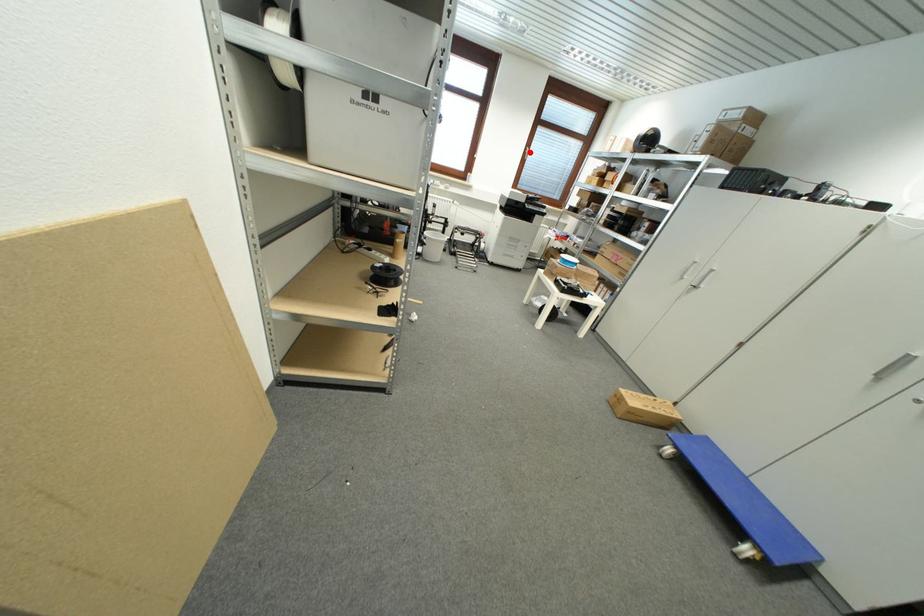
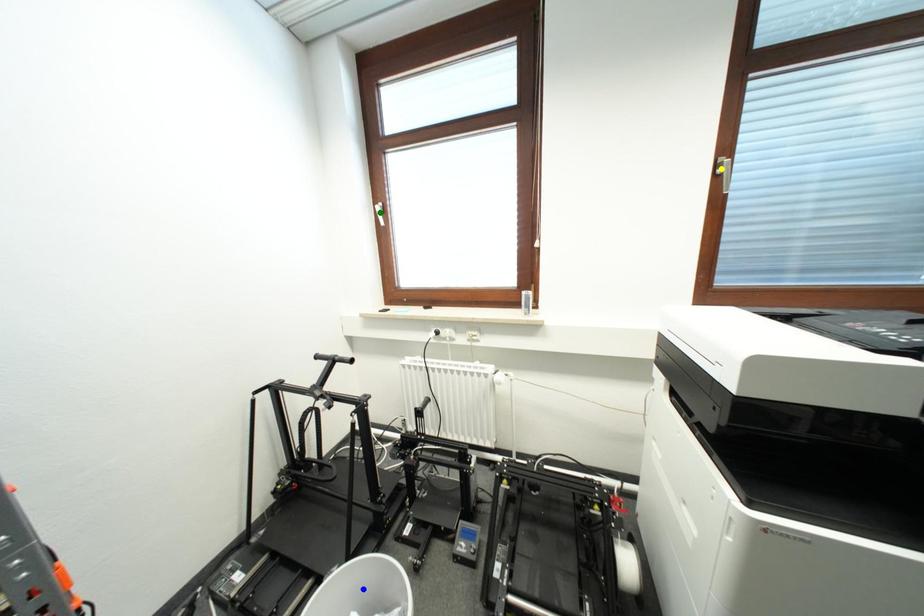
Question: I am providing you with two images of the same scene from different viewpoints. A red point is marked on the first image. You are given multiple points on the second image. Can you choose the point in image 2 that corresponds to the point in image 1?

Choices:
 (A) yellow point
 (B) green point
 (C) blue point

Answer: (A)